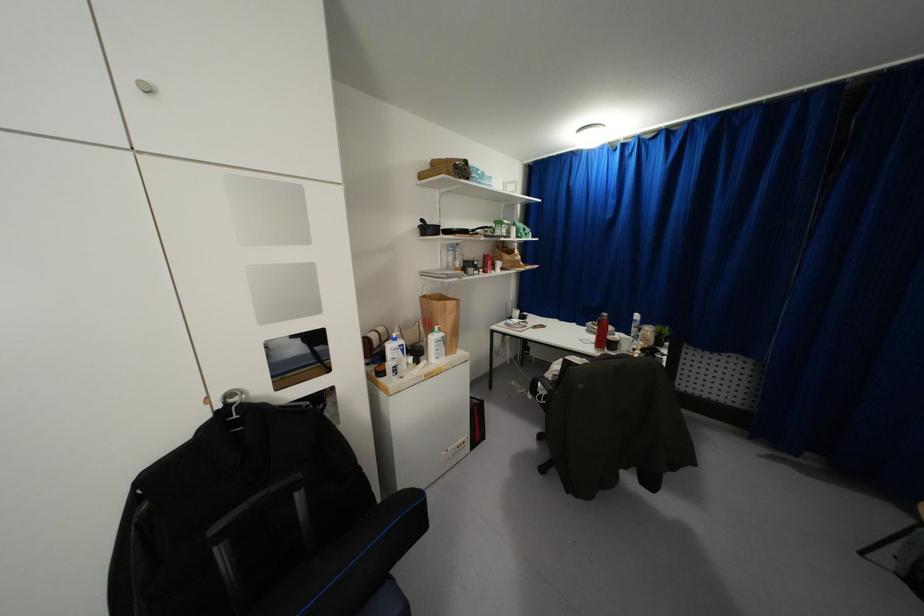
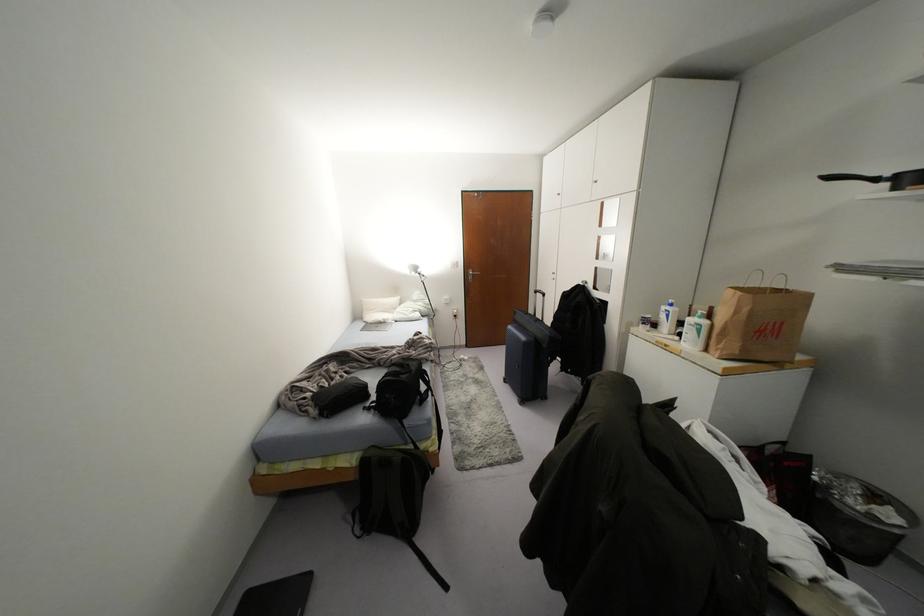
In the second image, find the point that corresponds to (442,333) in the first image.

(703, 322)